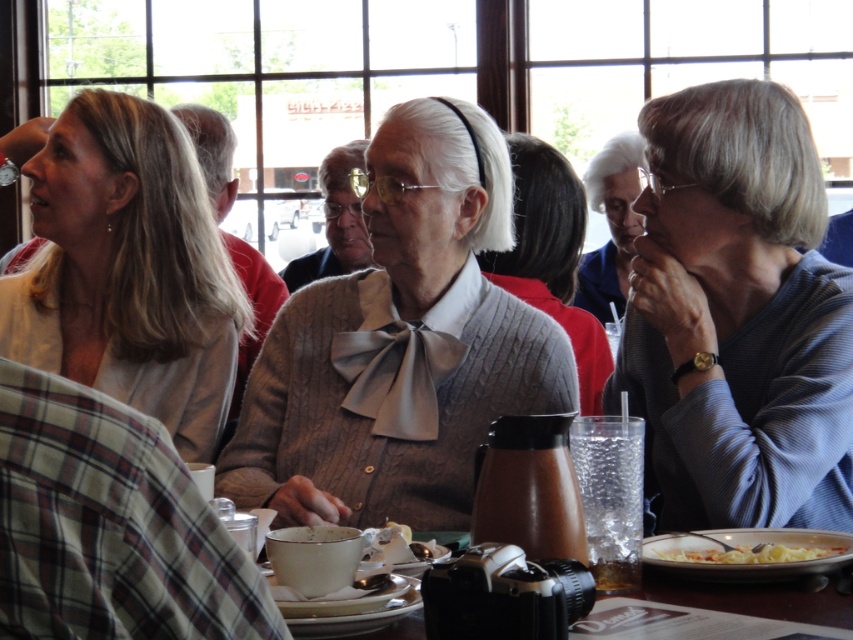
Question: Is blue striped sweater at right bigger than matte beige sweater at left?

Choices:
 (A) no
 (B) yes

Answer: (A)

Question: Estimate the real-world distances between objects in this image. Which object is farther from the white crumbly cake at center?

Choices:
 (A) white matte pasta bowl at lower right
 (B) white pasta at lower right
 (C) matte black camera at center

Answer: (A)

Question: Can you confirm if blue fabric shirt at center is bigger than white pasta at lower right?

Choices:
 (A) yes
 (B) no

Answer: (A)

Question: Which object appears farthest from the camera in this image?

Choices:
 (A) white crumbly cake at center
 (B) matte ceramic cup at lower center

Answer: (A)

Question: Which object is closer to the camera taking this photo?

Choices:
 (A) matte ceramic cup at lower center
 (B) knitted gray sweater at center
 (C) matte black camera at center
 (D) white matte pasta bowl at lower right

Answer: (C)

Question: Does blue striped sweater at right have a lesser width compared to blue fabric shirt at center?

Choices:
 (A) no
 (B) yes

Answer: (A)